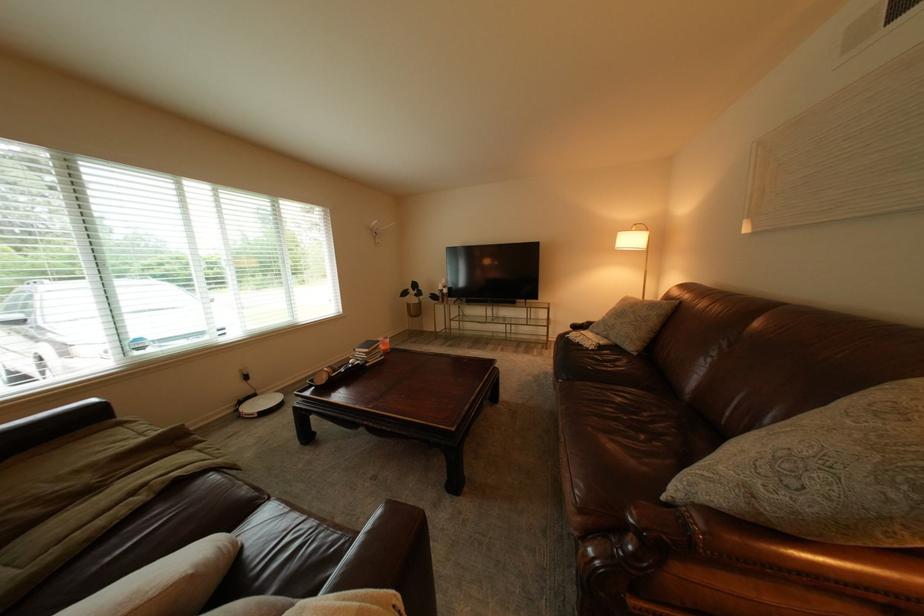
What do you see at coordinates (736, 570) in the screenshot? I see `a sofa armrest` at bounding box center [736, 570].